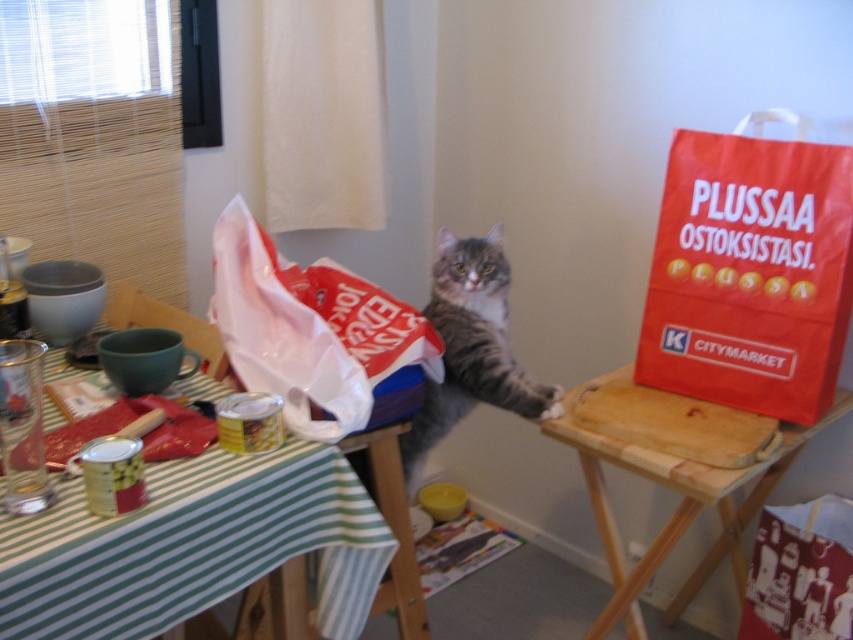
You are a person standing in the kitchen looking at the table. Where is the green striped fabric at lower left located?

The green striped fabric at lower left is located at point [193,547].